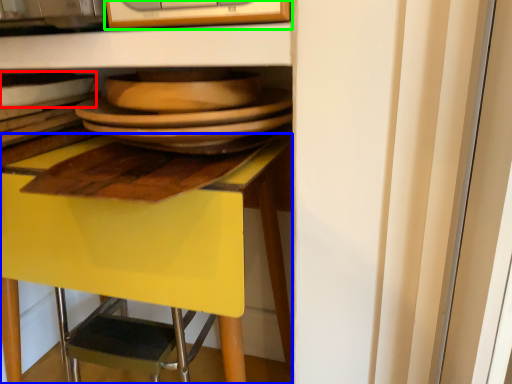
Question: Considering the real-world distances, which object is farthest from tableware (highlighted by a red box)? desk (highlighted by a blue box) or appliance (highlighted by a green box)?

Choices:
 (A) desk
 (B) appliance

Answer: (A)